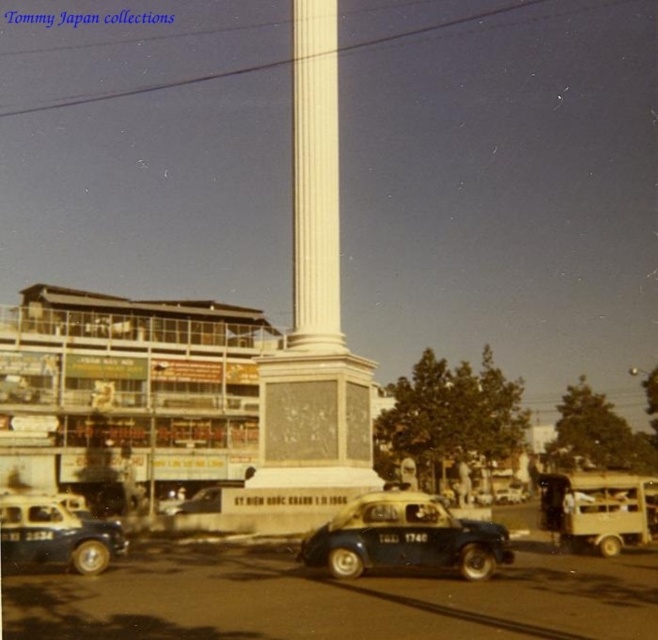
You are a pedestrian standing at the point marked by coordinates (405, 538) in this urban scene. You want to cross the street to reach the tall white column monument in the center. Is there a blue matte car at center blocking your path?

The blue matte car at center is located exactly at the point (405, 538), so it is blocking your path to the tall white column monument in the center.

You are a pedestrian standing at the monument and want to hail a taxi. Which taxi, the blue matte taxi at lower left or the metallic blue car at center, is closer to you?

The blue matte taxi at lower left is closer to you because it is positioned to the right of the metallic blue car at center, meaning it is nearer in the scene.